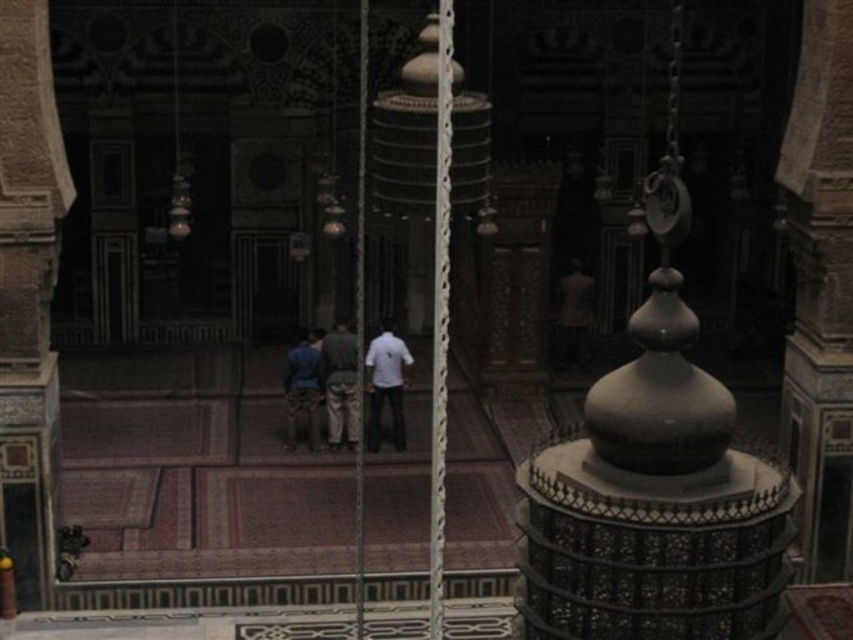
You are an architect designing a new religious building and want to incorporate clothing elements into the interior design. If you place the white matte shirt at center and blue fabric pants at center in the same area, which clothing item would be visible on top?

The white matte shirt at center is positioned over blue fabric pants at center, so the white matte shirt at center would be visible on top.

You are standing in the grand mosque and want to take a photo of both the white matte shirt at center and the blue fabric pants at center. Since you can only focus on one object at a time, which one should you focus on first to ensure it appears sharp in the photo?

You should focus on the white matte shirt at center first because it is closer to you than the blue fabric pants at center, so adjusting focus to the shirt will ensure it is sharp, and the pants may also be in focus due to depth of field.